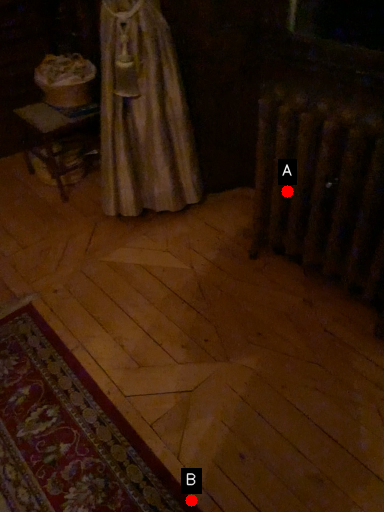
Question: Two points are circled on the image, labeled by A and B beside each circle. Which point appears farthest from the camera in this image?

Choices:
 (A) A is further
 (B) B is further

Answer: (A)